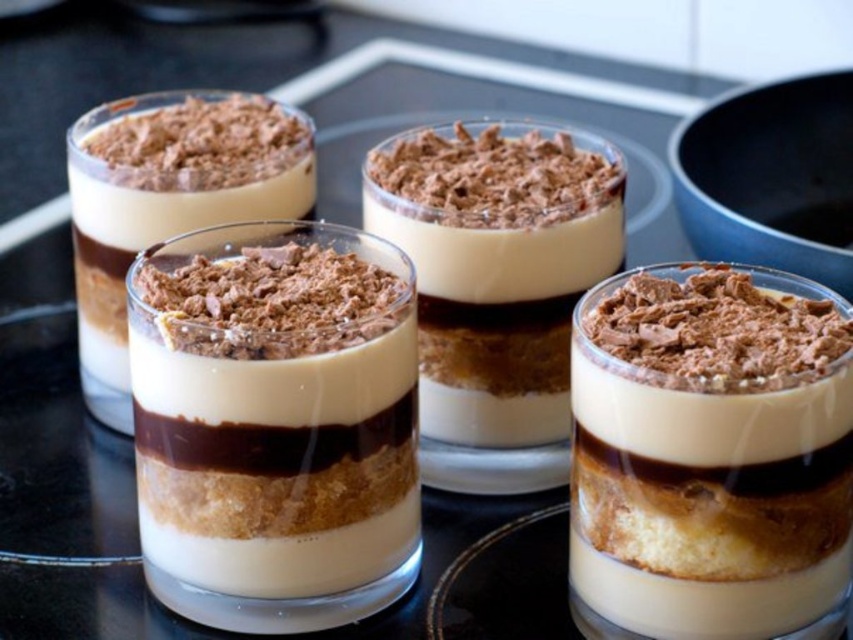
Question: Estimate the real-world distances between objects in this image. Which object is closer to the smooth chocolate mousse at center?

Choices:
 (A) white creamy pudding at center
 (B) matte chocolate dessert at center
 (C) matte chocolate pudding at center

Answer: (B)

Question: Among these objects, which one is nearest to the camera?

Choices:
 (A) white creamy pudding at center
 (B) matte chocolate dessert at center

Answer: (A)

Question: Is matte chocolate pudding at center wider than matte chocolate dessert at center?

Choices:
 (A) no
 (B) yes

Answer: (A)

Question: Can you confirm if white creamy pudding at center is positioned below matte chocolate dessert at center?

Choices:
 (A) yes
 (B) no

Answer: (A)

Question: Which object is the closest to the white creamy pudding at center?

Choices:
 (A) matte chocolate dessert at center
 (B) matte chocolate pudding at center

Answer: (A)

Question: Does matte chocolate pudding at center have a lesser width compared to smooth chocolate mousse at center?

Choices:
 (A) yes
 (B) no

Answer: (A)